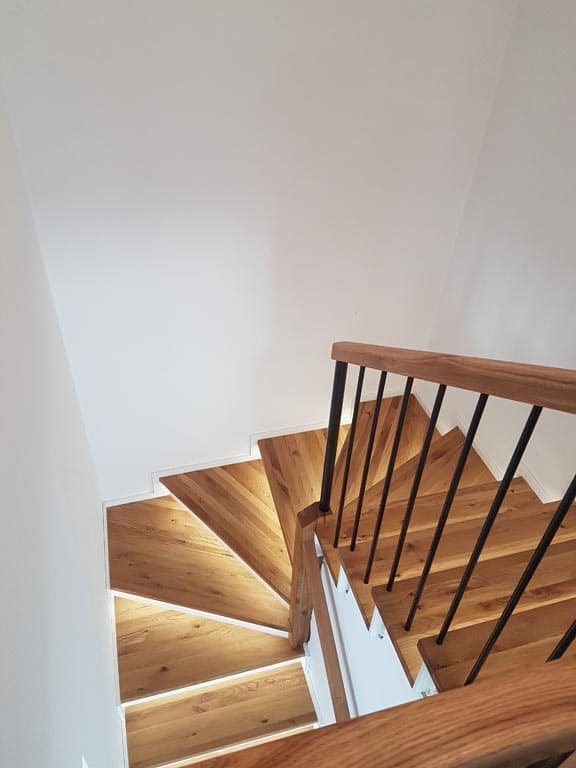
This screenshot has height=768, width=576. What are the coordinates of `black bars on stairs` in the screenshot? It's located at (328, 468), (346, 465), (363, 462), (388, 459), (420, 465), (456, 474), (506, 482), (554, 517), (566, 639).